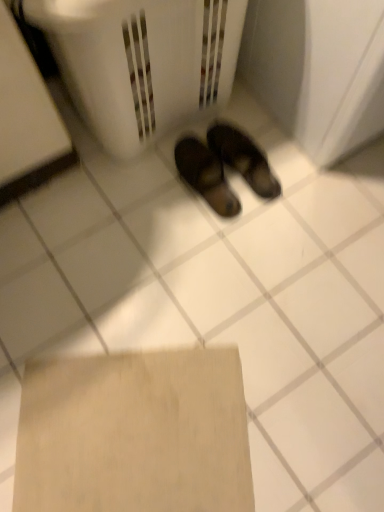
Image resolution: width=384 pixels, height=512 pixels. What do you see at coordinates (223, 167) in the screenshot?
I see `brown leather sandals at center` at bounding box center [223, 167].

The image size is (384, 512). What are the coordinates of `brown leather sandals at center` in the screenshot? It's located at (223, 167).

Describe the element at coordinates (134, 433) in the screenshot. The height and width of the screenshot is (512, 384). I see `beige cardboard at lower center` at that location.

Describe the element at coordinates (141, 62) in the screenshot. I see `white plastic laundry basket at center` at that location.

Identify the location of brown leather sandals at center. (223, 167).

Is brown leather sandals at center at the left side of beige cardboard at lower center?

No.

Is brown leather sandals at center in front of beige cardboard at lower center?

Result: No, brown leather sandals at center is further to the viewer.

In the scene shown: What's the angular difference between brown leather sandals at center and beige cardboard at lower center's facing directions?

There is a 123-degree angle between the facing directions of brown leather sandals at center and beige cardboard at lower center.

Identify the location of cardboard below the brown leather sandals at center (from the image's perspective). (134, 433).

At what (x,y) coordinates should I click in order to perform the action: click on footwear directly beneath the white plastic laundry basket at center (from a real-world perspective). Please return your answer as a coordinate pair (x, y). The image size is (384, 512). Looking at the image, I should click on (223, 167).

Between white plastic laundry basket at center and brown leather sandals at center, which one appears on the left side from the viewer's perspective?

Positioned to the left is white plastic laundry basket at center.

Looking at this image, considering the relative sizes of white plastic laundry basket at center and brown leather sandals at center in the image provided, is white plastic laundry basket at center thinner than brown leather sandals at center?

Incorrect, the width of white plastic laundry basket at center is not less than that of brown leather sandals at center.

Which is correct: white plastic laundry basket at center is inside brown leather sandals at center, or outside of it?

white plastic laundry basket at center lies outside brown leather sandals at center.

Which object is positioned more to the left, brown leather sandals at center or white plastic laundry basket at center?

From the viewer's perspective, white plastic laundry basket at center appears more on the left side.

How many degrees apart are the facing directions of brown leather sandals at center and white plastic laundry basket at center?

→ They differ by 179 degrees in their facing directions.

Between brown leather sandals at center and white plastic laundry basket at center, which one has smaller size?

brown leather sandals at center is smaller.

Between point (247, 178) and point (108, 12), which one is positioned behind?

Point (247, 178)

Can you confirm if beige cardboard at lower center is thinner than brown leather sandals at center?

No, beige cardboard at lower center is not thinner than brown leather sandals at center.

Between beige cardboard at lower center and brown leather sandals at center, which one appears on the left side from the viewer's perspective?

beige cardboard at lower center is more to the left.

From the image's perspective, does beige cardboard at lower center appear higher than brown leather sandals at center?

No, from the image's perspective, beige cardboard at lower center is not on top of brown leather sandals at center.

Based on the photo, is beige cardboard at lower center surrounding brown leather sandals at center?

No, brown leather sandals at center is not a part of beige cardboard at lower center.

From a real-world perspective, relative to white plastic laundry basket at center, is beige cardboard at lower center vertically above or below?

In terms of real-world spatial position, beige cardboard at lower center is below white plastic laundry basket at center.

Would you say beige cardboard at lower center is outside white plastic laundry basket at center?

Yes, beige cardboard at lower center is located beyond the bounds of white plastic laundry basket at center.

Who is smaller, beige cardboard at lower center or white plastic laundry basket at center?

beige cardboard at lower center.

How many degrees apart are the facing directions of beige cardboard at lower center and white plastic laundry basket at center?

The angle between the facing direction of beige cardboard at lower center and the facing direction of white plastic laundry basket at center is 58.1 degrees.

From a real-world perspective, does white plastic laundry basket at center stand above beige cardboard at lower center?

Correct, in the physical world, white plastic laundry basket at center is higher than beige cardboard at lower center.

Identify the location of cardboard behind the white plastic laundry basket at center. The width and height of the screenshot is (384, 512). (134, 433).

Considering the points (132, 114) and (196, 409), which point is behind, point (132, 114) or point (196, 409)?

The point (132, 114) is farther.

Based on their positions, is white plastic laundry basket at center located to the left or right of beige cardboard at lower center?

In the image, white plastic laundry basket at center appears on the right side of beige cardboard at lower center.

The height and width of the screenshot is (512, 384). I want to click on footwear located above the beige cardboard at lower center (from the image's perspective), so click(x=223, y=167).

The image size is (384, 512). Find the location of `footwear that is behind the white plastic laundry basket at center`. footwear that is behind the white plastic laundry basket at center is located at coordinates (223, 167).

When comparing their distances from beige cardboard at lower center, does brown leather sandals at center or white plastic laundry basket at center seem closer?

Among the two, brown leather sandals at center is located nearer to beige cardboard at lower center.

Based on their spatial positions, is brown leather sandals at center or beige cardboard at lower center closer to white plastic laundry basket at center?

brown leather sandals at center.

From the image, which object appears to be farther from beige cardboard at lower center, white plastic laundry basket at center or brown leather sandals at center?

Based on the image, white plastic laundry basket at center appears to be further to beige cardboard at lower center.

Based on their spatial positions, is beige cardboard at lower center or white plastic laundry basket at center further from brown leather sandals at center?

beige cardboard at lower center is positioned further to the anchor brown leather sandals at center.

Considering their positions, is beige cardboard at lower center positioned closer to white plastic laundry basket at center than brown leather sandals at center?

The object closer to white plastic laundry basket at center is brown leather sandals at center.

Estimate the real-world distances between objects in this image. Which object is further from brown leather sandals at center, white plastic laundry basket at center or beige cardboard at lower center?

The object further to brown leather sandals at center is beige cardboard at lower center.

Where is `footwear between white plastic laundry basket at center and beige cardboard at lower center in the up-down direction`? This screenshot has height=512, width=384. footwear between white plastic laundry basket at center and beige cardboard at lower center in the up-down direction is located at coordinates (223, 167).